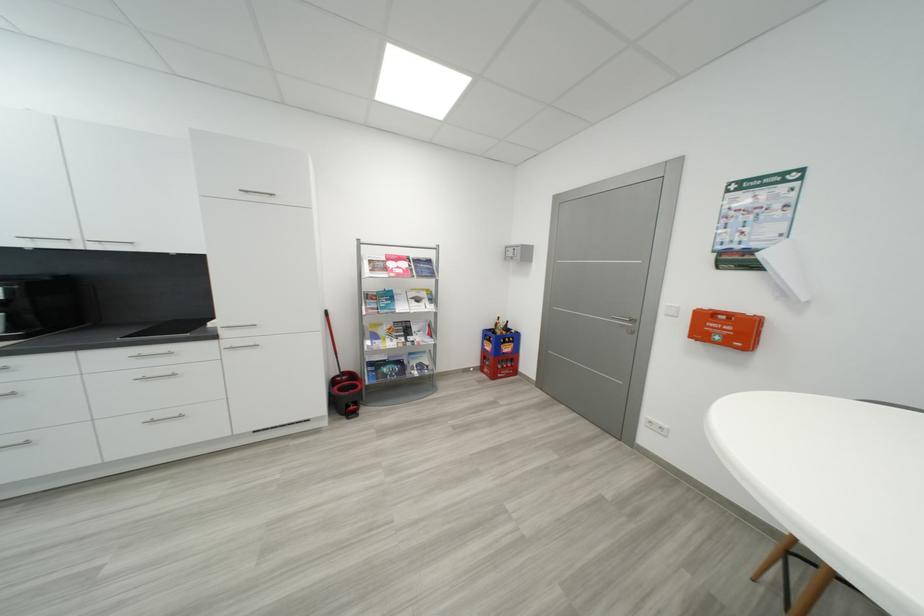
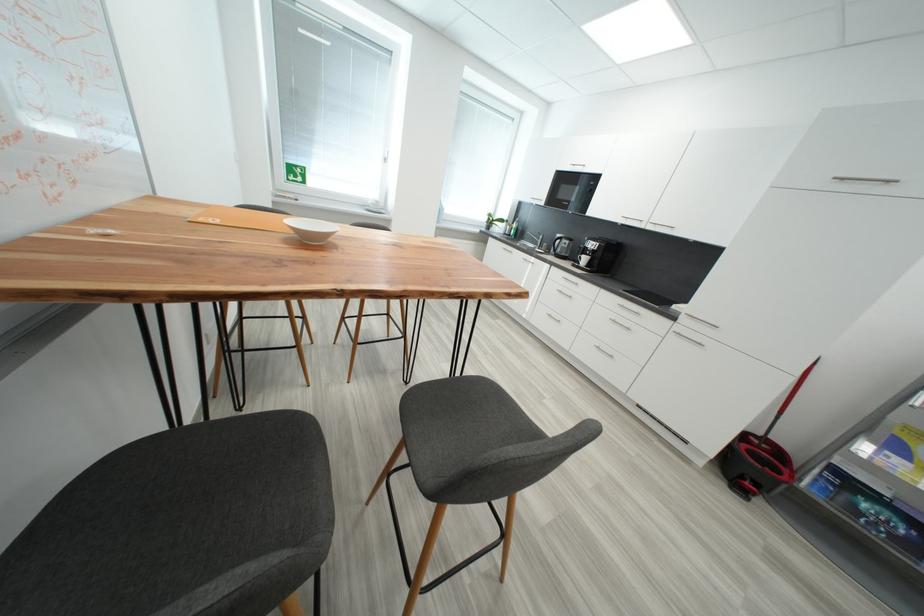
From the picture: First-person continuous shooting, in which direction is the camera rotating?

The camera rotated toward left-down.